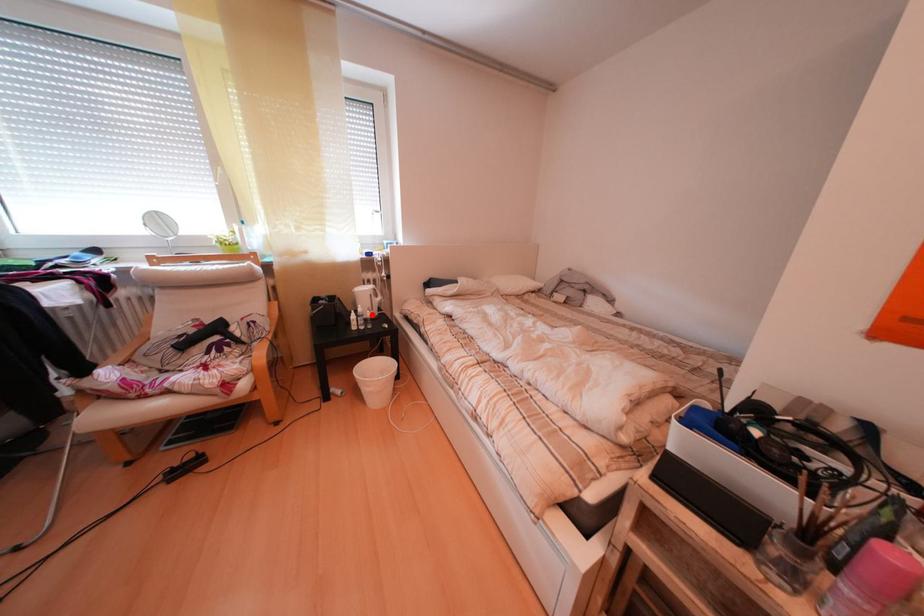
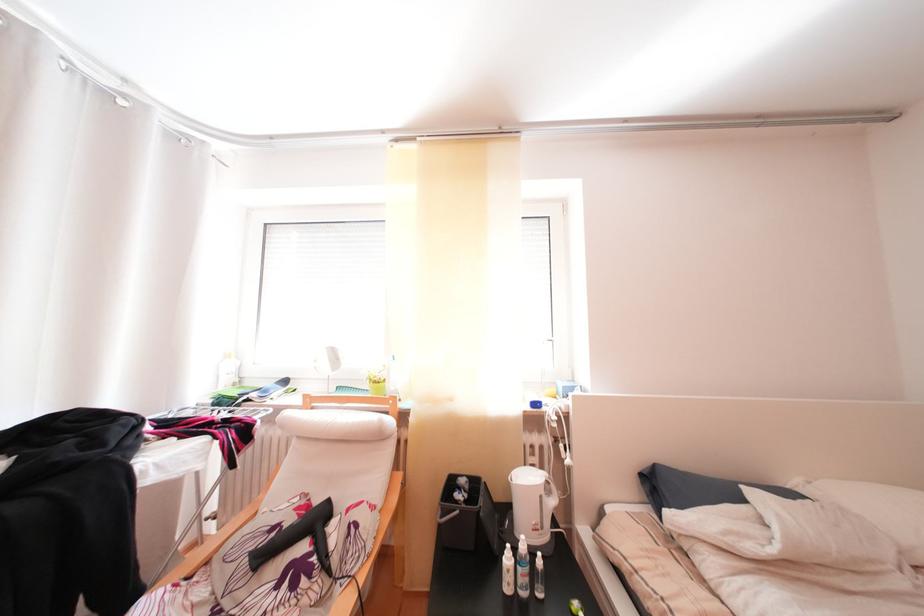
The point at the highlighted location is marked in the first image. Where is the corresponding point in the second image?

(536, 553)